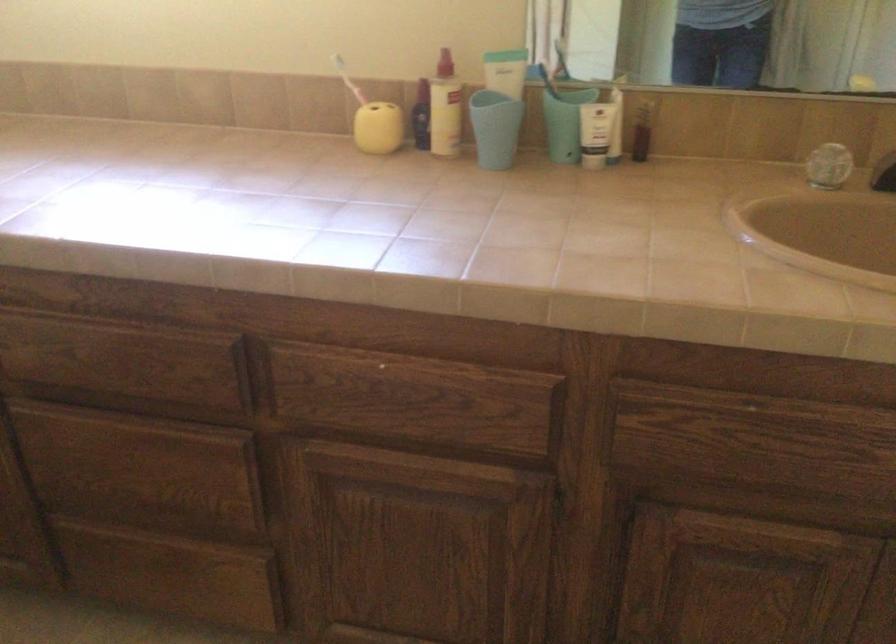
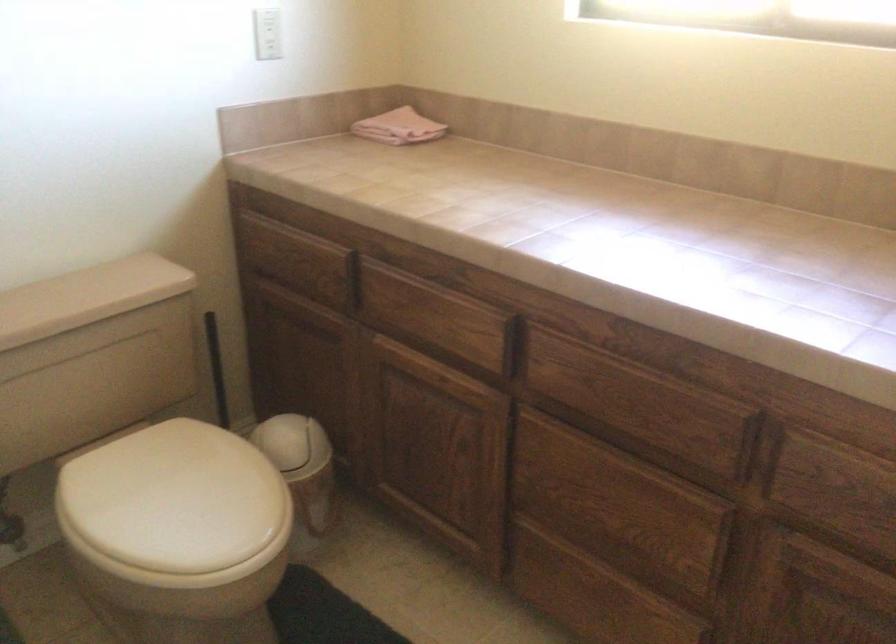
In the second image, find the point that corresponds to [331,399] in the first image.

(837, 493)